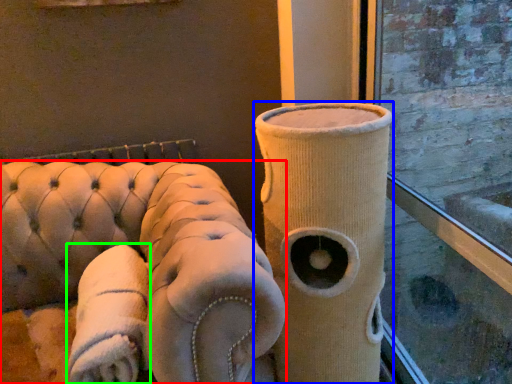
Question: Based on their relative distances, which object is nearer to furniture (highlighted by a red box)? Choose from vase (highlighted by a blue box) and cloth (highlighted by a green box).

Choices:
 (A) vase
 (B) cloth

Answer: (B)